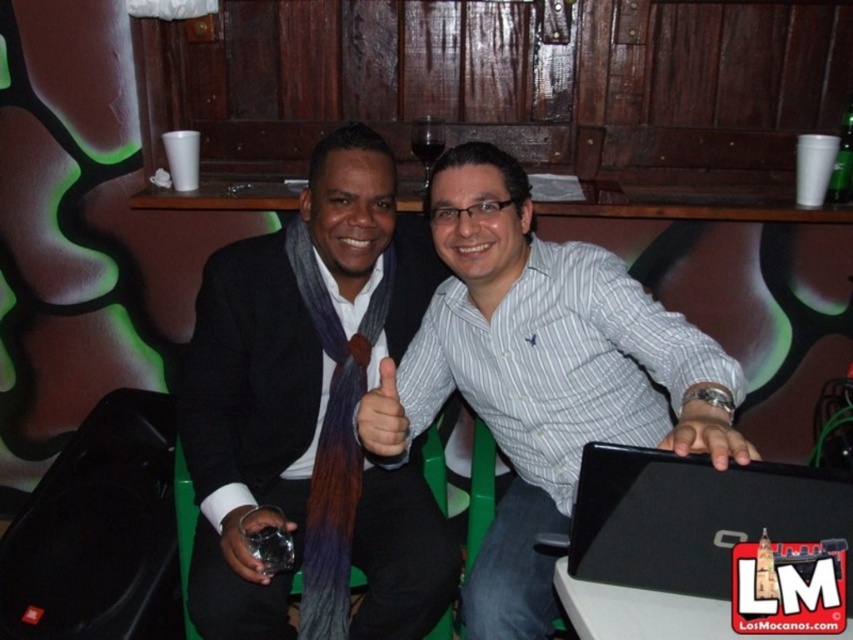
You are a photographer taking a picture of the scene. You notice the white striped shirt at center and the green glass bottle at upper right. To ensure both are in frame, should you adjust your camera to the left or right?

The white striped shirt at center is to the left of the green glass bottle at upper right. To include both in the frame, you should adjust the camera to the right to capture the leftmost object and the rightmost object within the same shot.

You are a photographer positioned at the center of the room. You want to take a photo of the matte black suit at center. Based on the coordinates provided in the Objects Description, where should you aim your camera to capture the suit in the frame?

The matte black suit at center is located at point coordinates (312, 410), so you should aim your camera at those coordinates to capture the suit in the frame.